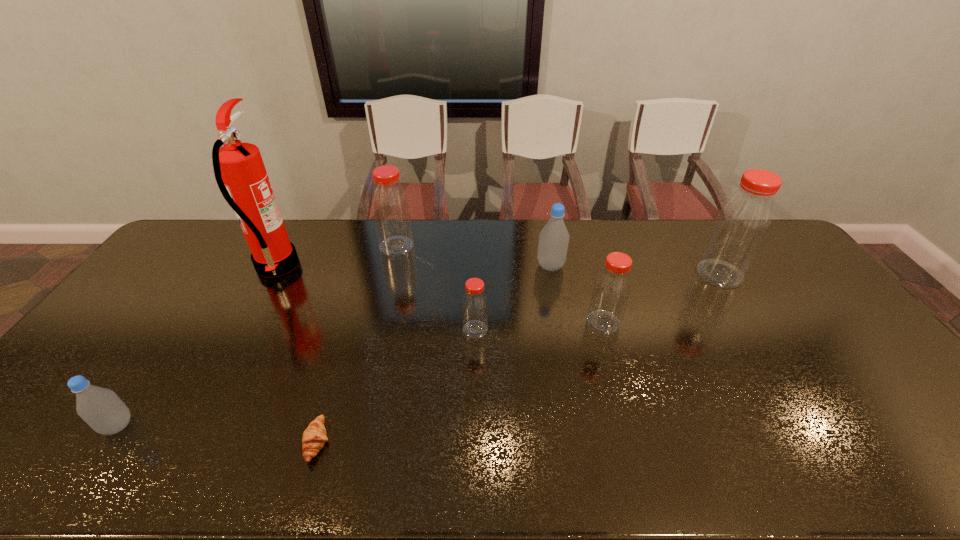
The image size is (960, 540). In order to click on the fourth object from right to left in this screenshot , I will do `click(474, 302)`.

This screenshot has height=540, width=960. In order to click on the fourth bottle from right to left in this screenshot , I will do `click(474, 302)`.

Identify the location of the left gray bottle. This screenshot has width=960, height=540. (101, 408).

Locate an element on the screen. the leftmost bottle is located at coordinates (101, 408).

Locate an element on the screen. Image resolution: width=960 pixels, height=540 pixels. the shortest object is located at coordinates (314, 437).

The image size is (960, 540). Identify the location of vacant space located with the nozzle aimed from the second object from left to right. (371, 266).

Locate an element on the screen. vacant area situated on the right of the rightmost bottle is located at coordinates (793, 274).

Locate an element on the screen. Image resolution: width=960 pixels, height=540 pixels. free region located 0.260m on the left of the second bottle from left to right is located at coordinates (307, 247).

Identify the location of vacant space located on the left of the sixth object from left to right. The image size is (960, 540). (443, 266).

Identify the location of vacant space located on the back of the second smallest red bottle. This screenshot has height=540, width=960. coord(588,272).